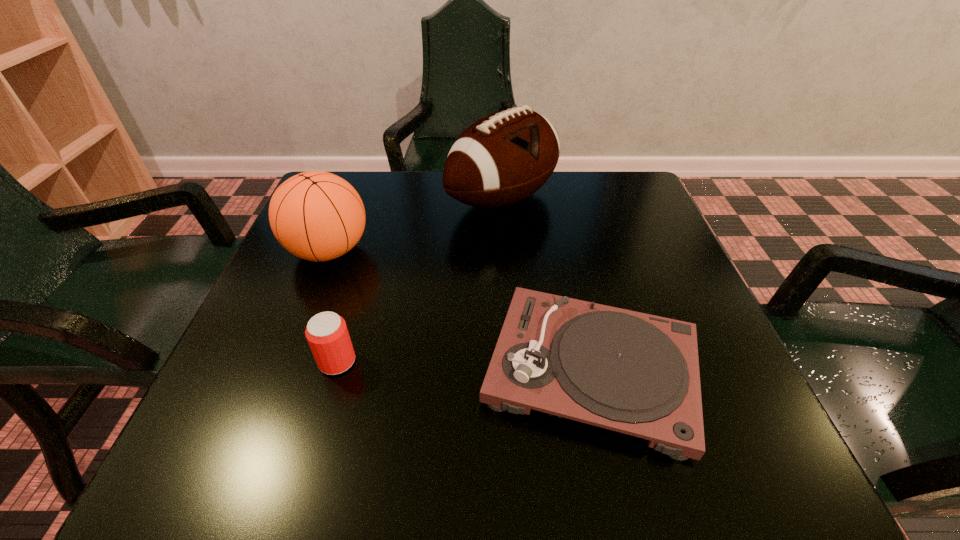
Where is `empty location between the phonograph_record and the basketball`? empty location between the phonograph_record and the basketball is located at coordinates (460, 310).

I want to click on vacant space in between the football (American) and the third tallest object, so tap(420, 280).

What are the coordinates of `blank region between the phonograph_record and the beer can` in the screenshot? It's located at (465, 366).

I want to click on unoccupied area between the tallest object and the second shortest object, so click(420, 280).

Image resolution: width=960 pixels, height=540 pixels. What are the coordinates of `free space between the third tallest object and the shortest object` in the screenshot? It's located at click(x=465, y=366).

You are a GUI agent. You are given a task and a screenshot of the screen. Output one action in this format:
    pyautogui.click(x=<x>, y=<y>)
    Task: Click on the empty space that is in between the football (American) and the shortest object
    The image size is (960, 540).
    Given the screenshot: What is the action you would take?
    pyautogui.click(x=547, y=285)

Identify the location of free space between the phonograph_record and the third shortest object. [460, 310].

At what (x,y) coordinates should I click in order to perform the action: click on free space between the football (American) and the basketball. Please return your answer as a coordinate pair (x, y). The image size is (960, 540). Looking at the image, I should click on (416, 225).

Identify the location of free spot between the beer can and the tallest object. This screenshot has height=540, width=960. (420, 280).

Find the location of a particular element. The image size is (960, 540). free spot between the shortest object and the football (American) is located at coordinates (547, 285).